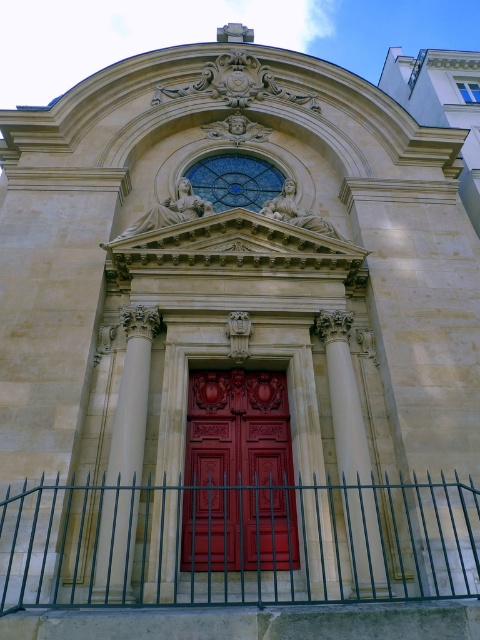
You are an architect evaluating the symmetry of the building facade. Given the presence of the green metal fence at center and the white stone column at center, which object would you measure first to assess their alignment with the central axis?

You should first measure the green metal fence at center because its width is larger than the white stone column at center, making it a more significant element to ensure proper alignment with the central axis.

Looking at this image, you are an architect planning to install a new sign above the glossy wood door at center and the smooth stone column at center. The sign must be as wide as the widest object between them. Which object should you use to determine the sign width?

The glossy wood door at center has a larger width than the smooth stone column at center, so the sign should be as wide as the glossy wood door at center.